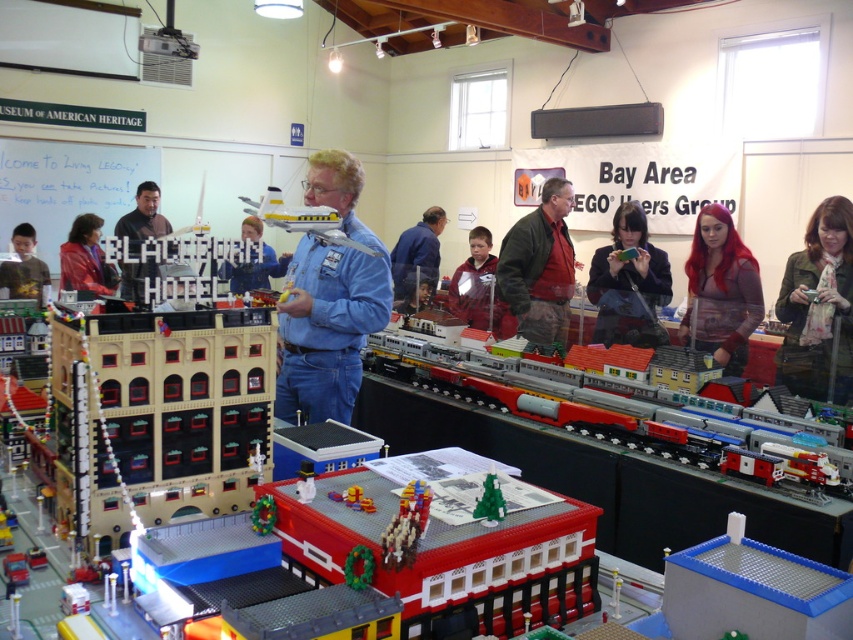
You are standing at the entrance of the LEGO exhibition and see the Blackburn Hotel LEGO model on the left and the camouflage jacket at center. Which object is closer to you?

The camouflage jacket at center is closer to you because they are 11.36 feet apart, so the camouflage jacket at center is nearer than the Blackburn Hotel LEGO model on the left.

You are a photographer at the LEGO event and need to take a clear photo of the Blackburn Hotel. However, there are two people in the way wearing a camouflage jacket at center and a plaid shirt at center. Which clothing item is blocking your view more directly?

The camouflage jacket at center is positioned over plaid shirt at center, so the camouflage jacket at center is blocking the view more directly.

You are organizing a photo shoot for a fashion magazine and need to decide which of the two center items, the camouflage jacket at center or the plaid shirt at center, will better fill the frame. Based on their sizes, which one should you choose?

The camouflage jacket at center is bigger than the plaid shirt at center, so it will better fill the frame for the photo shoot.